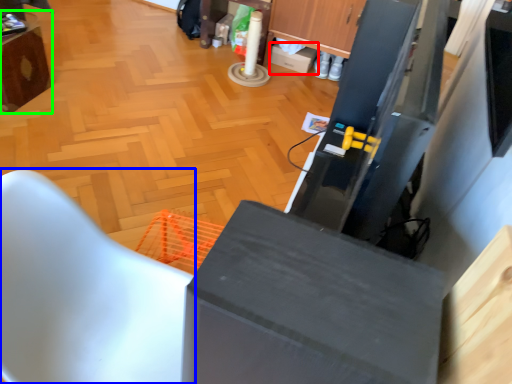
Question: Which object is the closest to the box (highlighted by a red box)? Choose among these: furniture (highlighted by a blue box) or furniture (highlighted by a green box).

Choices:
 (A) furniture
 (B) furniture

Answer: (B)